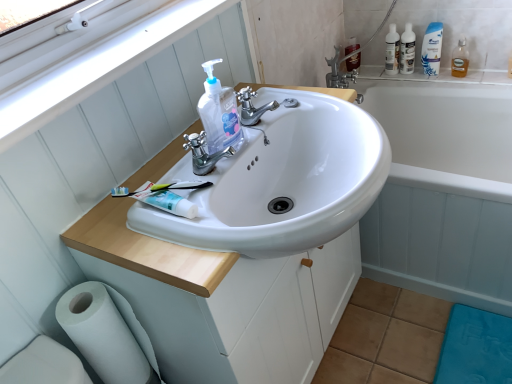
Image resolution: width=512 pixels, height=384 pixels. Identify the location of free space in front of polished chrome faucet at center, positioned as the second tap in right-to-left order. (194, 232).